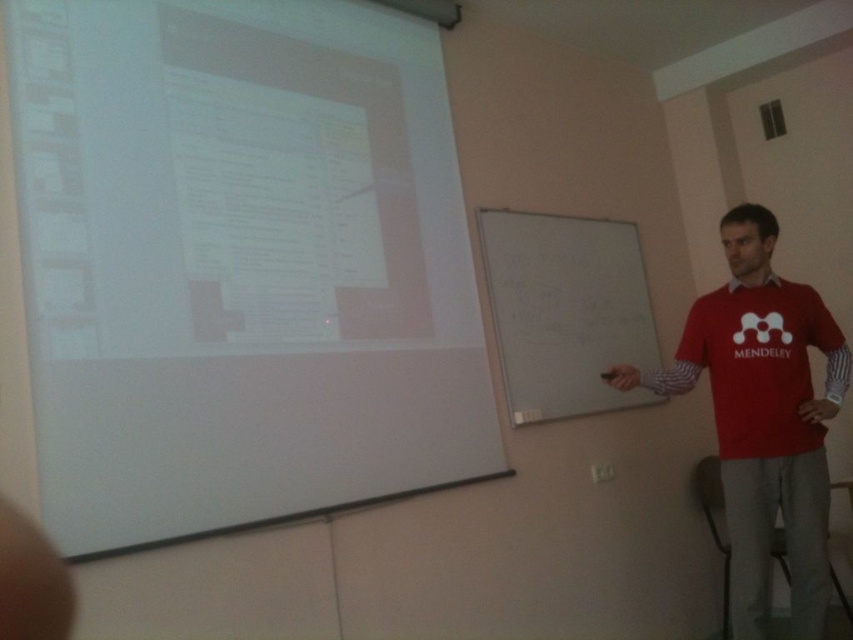
You are standing in the classroom and want to plug in a laptop charger. The charger cord is 1 meter long. There is an electrical outlet on the wall below the whiteboard. If you are standing at point (747, 636), can you reach the outlet at point (770, 300) without moving your position?

Point (747, 636) is in front of point (770, 300). Since the outlet is behind you relative to your position, you cannot reach it without moving.

You are a student sitting in the classroom and want to take a photo of the white matte projection screen at upper left and the red cotton shirt at right. Which object will appear larger in your photo?

The white matte projection screen at upper left will appear larger in the photo because it is closer to the viewer than the red cotton shirt at right.

You are a student sitting in the classroom and want to take a photo of the white matte projection screen at upper left and the red cotton shirt at right. Which object will appear larger in your photo?

The white matte projection screen at upper left will appear larger in the photo because it has a larger size compared to the red cotton shirt at right.